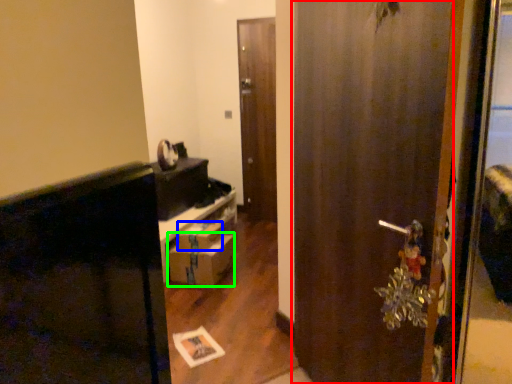
Question: Which is farther away from door (highlighted by a red box)? box (highlighted by a blue box) or drawer (highlighted by a green box)?

Choices:
 (A) box
 (B) drawer

Answer: (A)